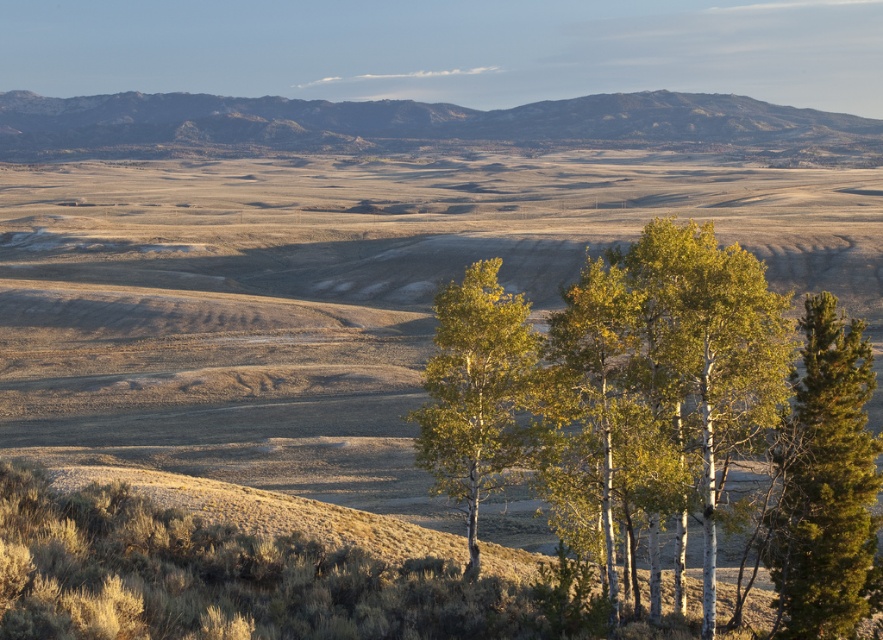
Question: Which point appears closest to the camera in this image?

Choices:
 (A) (849, 392)
 (B) (707, 250)

Answer: (B)

Question: Which object is farther from the camera taking this photo?

Choices:
 (A) green leafy birch at center
 (B) green bark trees at center

Answer: (A)

Question: Which object is closer to the camera taking this photo?

Choices:
 (A) green bark trees at center
 (B) rocky brown mountain at upper center

Answer: (A)

Question: Can you confirm if green bark trees at center is positioned below rocky brown mountain at upper center?

Choices:
 (A) yes
 (B) no

Answer: (A)

Question: Is green bark trees at center below green leafy birch at center?

Choices:
 (A) no
 (B) yes

Answer: (B)

Question: Can you confirm if green bark trees at center is thinner than rocky brown mountain at upper center?

Choices:
 (A) yes
 (B) no

Answer: (A)